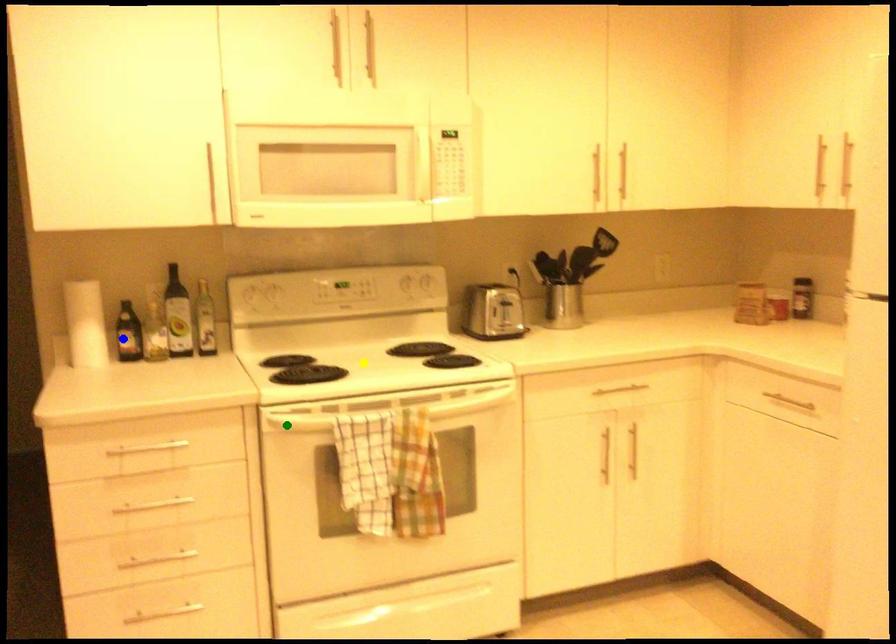
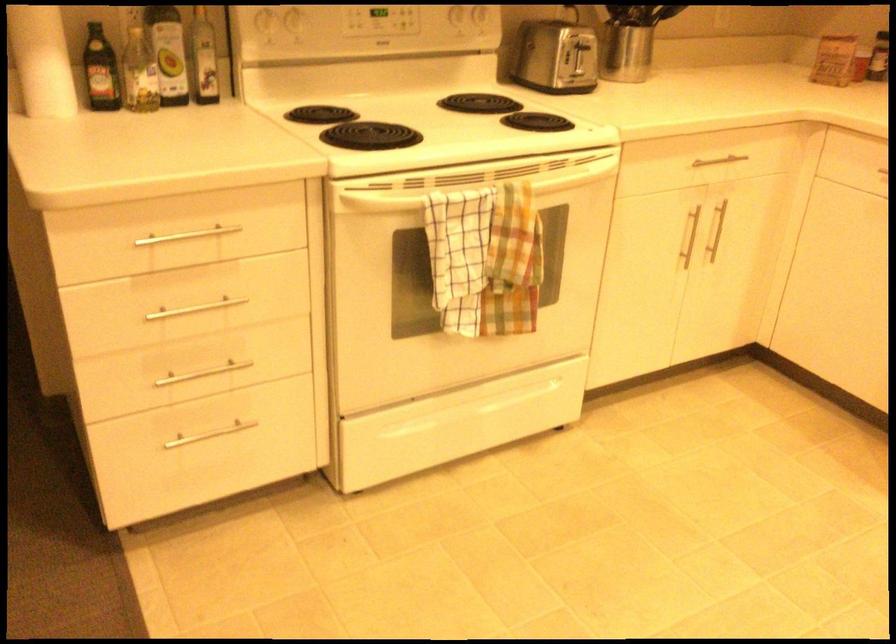
I am providing you with two images of the same scene from different viewpoints. Three points are marked in image1. Which point corresponds to a part or object that is occluded in image2?In image1, three points are marked. Which of them correspond to a part or object that is occluded in image2?Among the three points shown in image1, which one corresponds to a part or object that is no longer visible due to occlusion in image2?

Invisible in image2: yellow point.